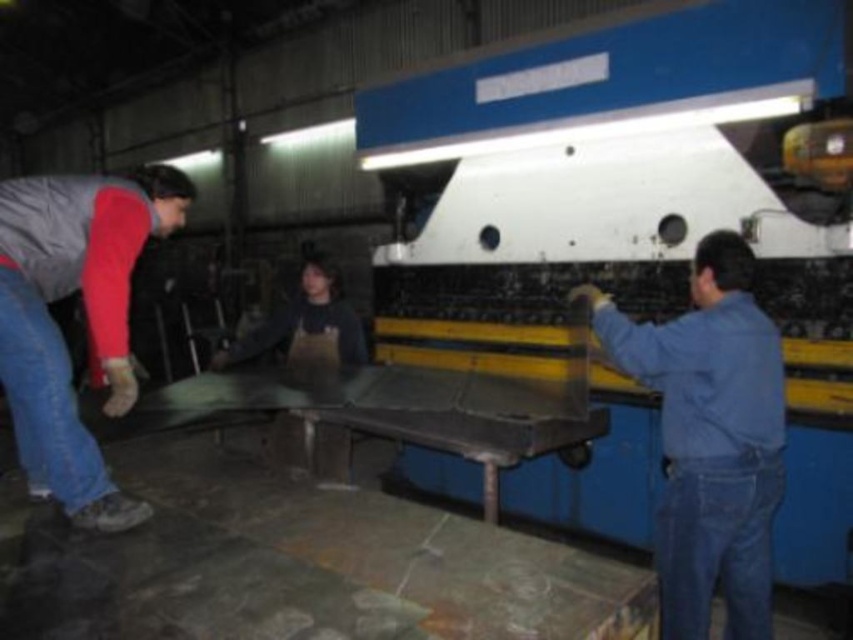
Can you confirm if blue denim jumpsuit at right is wider than blue denim jeans at lower left?

Yes, blue denim jumpsuit at right is wider than blue denim jeans at lower left.

Consider the image. Which is more to the right, blue denim jumpsuit at right or blue denim jeans at lower left?

Positioned to the right is blue denim jumpsuit at right.

Where is `blue denim jumpsuit at right`? The image size is (853, 640). blue denim jumpsuit at right is located at coordinates (711, 438).

From the picture: Between gray/red jacket at left and denim at right, which one is positioned higher?

gray/red jacket at left

Describe the element at coordinates (86, 317) in the screenshot. I see `gray/red jacket at left` at that location.

Is point (84, 236) farther from camera compared to point (660, 557)?

That is True.

Find the location of a particular element. The width and height of the screenshot is (853, 640). gray/red jacket at left is located at coordinates (86, 317).

Looking at this image, does blue denim jumpsuit at right have a greater height compared to gray/red jacket at left?

Indeed, blue denim jumpsuit at right has a greater height compared to gray/red jacket at left.

Which is in front, point (660, 596) or point (161, 173)?

Point (660, 596) is more forward.

Describe the element at coordinates (711, 438) in the screenshot. I see `blue denim jumpsuit at right` at that location.

Where is `blue denim jumpsuit at right`? blue denim jumpsuit at right is located at coordinates (711, 438).